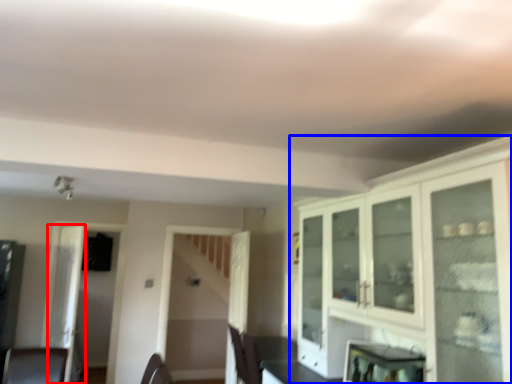
Question: Which point is further to the camera, glass door (highlighted by a red box) or cabinetry (highlighted by a blue box)?

Choices:
 (A) glass door
 (B) cabinetry

Answer: (A)